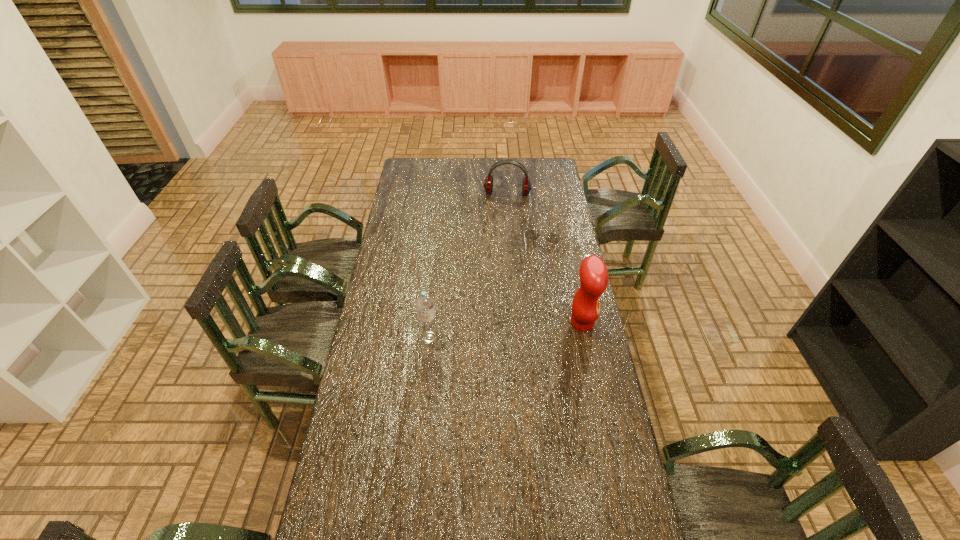
Locate an element on the screen. The image size is (960, 540). the leftmost object is located at coordinates (425, 304).

Find the location of a particular element. water bottle is located at coordinates (425, 304).

You are a GUI agent. You are given a task and a screenshot of the screen. Output one action in this format:
    pyautogui.click(x=<x>, y=<y>)
    Task: Click on the condiment
    The image size is (960, 540).
    Given the screenshot: What is the action you would take?
    pyautogui.click(x=593, y=272)

The image size is (960, 540). I want to click on the farthest object, so click(x=488, y=183).

Image resolution: width=960 pixels, height=540 pixels. What are the coordinates of `earphone` in the screenshot? It's located at (488, 183).

Locate an element on the screen. This screenshot has width=960, height=540. the shortest object is located at coordinates (531, 234).

This screenshot has width=960, height=540. I want to click on spectacles, so click(531, 234).

Find the location of a particular element. free spot located on the right of the leftmost object is located at coordinates (459, 338).

You are a GUI agent. You are given a task and a screenshot of the screen. Output one action in this format:
    pyautogui.click(x=<x>, y=<y>)
    Task: Click on the free space located on the ear cups of the earphone
    This screenshot has width=960, height=540.
    Given the screenshot: What is the action you would take?
    pyautogui.click(x=503, y=222)

You are a GUI agent. You are given a task and a screenshot of the screen. Output one action in this format:
    pyautogui.click(x=<x>, y=<y>)
    Task: Click on the blank area located on the ear cups of the earphone
    The width and height of the screenshot is (960, 540).
    Given the screenshot: What is the action you would take?
    pyautogui.click(x=502, y=228)